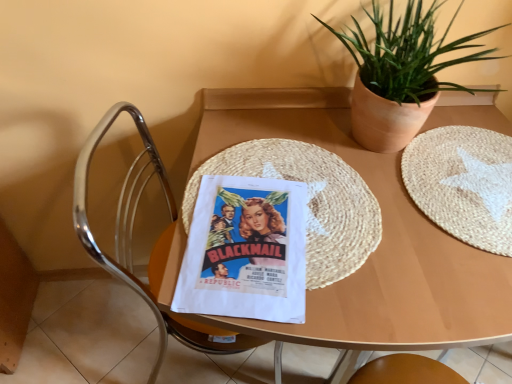
Locate an element on the screen. This screenshot has width=512, height=384. vacant space in front of green leafy plant in clay pot at upper right is located at coordinates (395, 221).